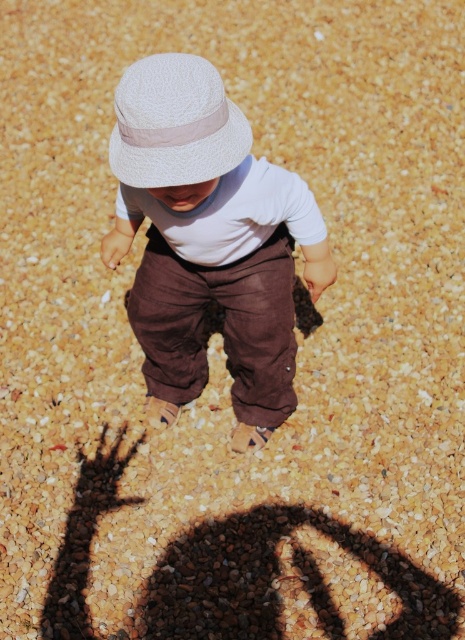
You are a photographer trying to capture the child in the image. You notice two hats on the child. Which hat is positioned lower on the child, the matte white hat at center or the white textured hat at upper center?

The matte white hat at center is positioned lower on the child than the white textured hat at upper center.

You are a photographer setting up for a shoot. You need to position a matte white hat at center and a white textured hat at upper center in the scene. According to the description, where should you place the matte white hat relative to the white textured hat?

The matte white hat at center should be placed to the right of the white textured hat at upper center.

Looking at this image, you are a photographer setting up for a shoot. You have to place two hats, the matte white hat at center and the white textured hat at upper center, in a way that they are exactly 38.25 centimeters apart. Given the scene described, where should you position them to ensure the correct distance?

Position the matte white hat at center and the white textured hat at upper center so that they are 38.25 centimeters apart, as specified in the description.